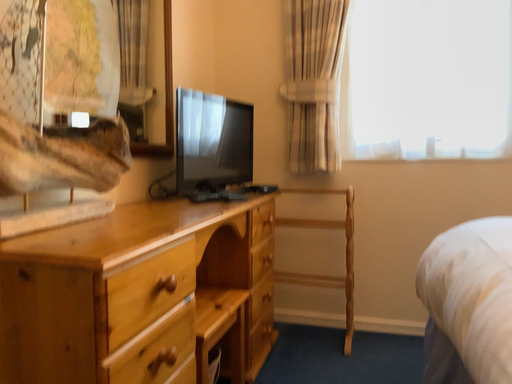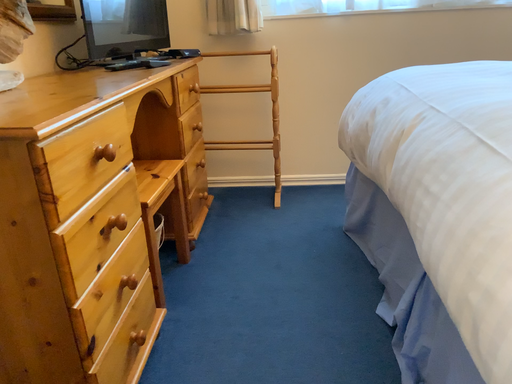
Question: Which way did the camera rotate in the video?

Choices:
 (A) rotated downward
 (B) rotated upward

Answer: (A)